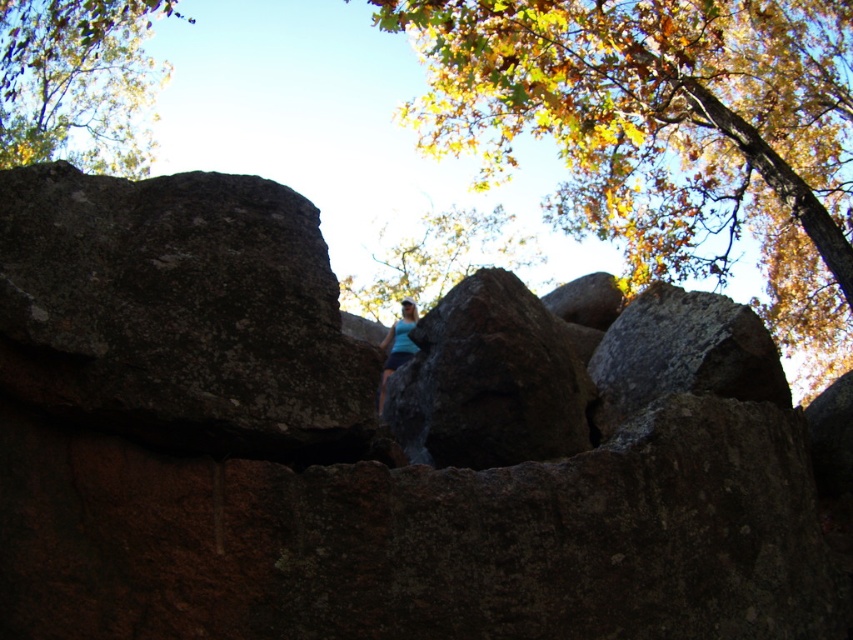
Question: Observing the image, what is the correct spatial positioning of green leafy tree at upper left in reference to blue fabric at center?

Choices:
 (A) left
 (B) right

Answer: (A)

Question: Is rough textured rock at center wider than green leafy tree at upper left?

Choices:
 (A) yes
 (B) no

Answer: (B)

Question: Which object is closer to the camera taking this photo?

Choices:
 (A) rough textured rock at center
 (B) yellow-green leaves at upper center
 (C) green leafy tree at upper left
 (D) green leafy tree at center

Answer: (A)

Question: Which object is positioned farthest from the green leafy tree at upper left?

Choices:
 (A) rusty stone boulder at center
 (B) blue fabric at center
 (C) yellow-green leaves at upper center

Answer: (B)

Question: Is yellow-green leaves at upper center to the right of green leafy tree at center from the viewer's perspective?

Choices:
 (A) yes
 (B) no

Answer: (A)

Question: Estimate the real-world distances between objects in this image. Which object is closer to the blue fabric at center?

Choices:
 (A) yellow-green leaves at upper center
 (B) green leafy tree at upper left
 (C) rusty stone boulder at center
 (D) rough textured rock at center

Answer: (D)